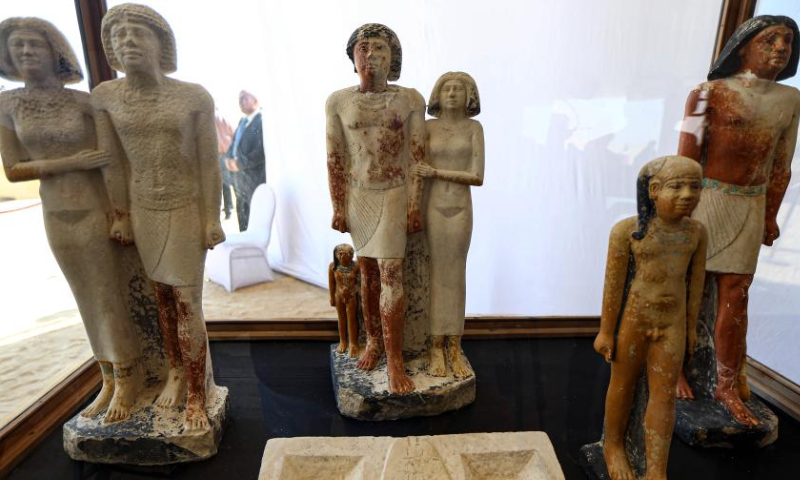
Find the location of `adult statue on right edge of case`. adult statue on right edge of case is located at coordinates (760, 89).